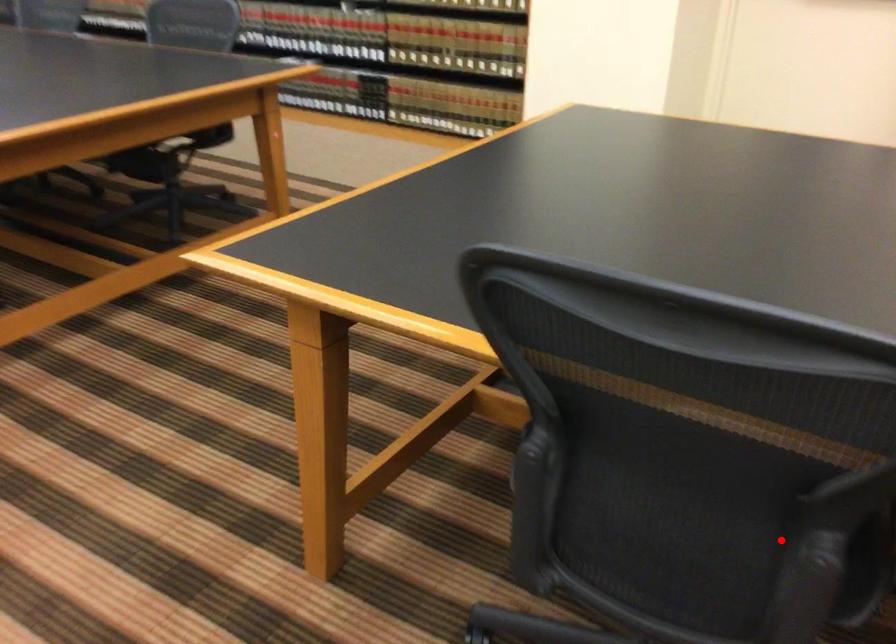
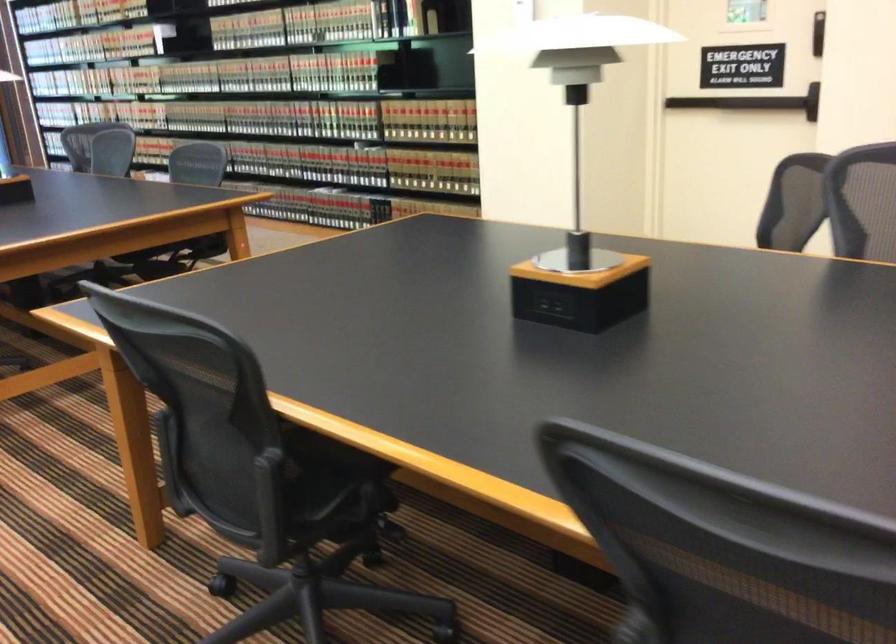
Question: I am providing you with two images of the same scene from different viewpoints. A red point is shown in image1. For the corresponding object point in image2, is it positioned nearer or farther from the camera?

Choices:
 (A) Nearer
 (B) Farther

Answer: (B)